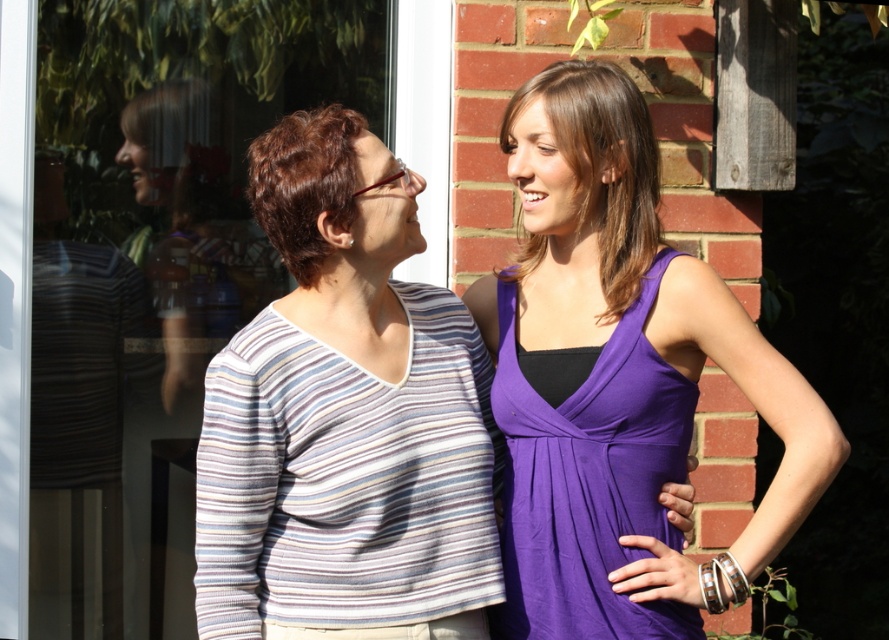
The two women are standing near a brick wall and a window. They are both wearing purple dresses. The woman on the left is wearing a purple fabric dress at right, and the woman on the right is wearing a purple satin dress at right. Which dress is closer to the window?

The purple fabric dress at right is 1.62 inches from the purple satin dress at right. Since both dresses are on the same person or near each other, it might be challenging to determine which is closer without more details. However, based on the description, the purple fabric dress at right is positioned closer to the window than the purple satin dress at right.

You are a fashion designer observing two dresses in the image. The first is a purple fabric dress at right, and the second is a purple satin dress at right. Which dress has a wider silhouette?

The purple fabric dress at right might be wider than purple satin dress at right.

You are a photographer trying to capture a clear photo of both the purple satin dress at right and the purple satin dress at upper right. However, you notice one is blocking the other. Which dress is in front and might be obscuring the view of the other?

The purple satin dress at right is in front of the purple satin dress at upper right, so it might be obscuring the view of the latter.